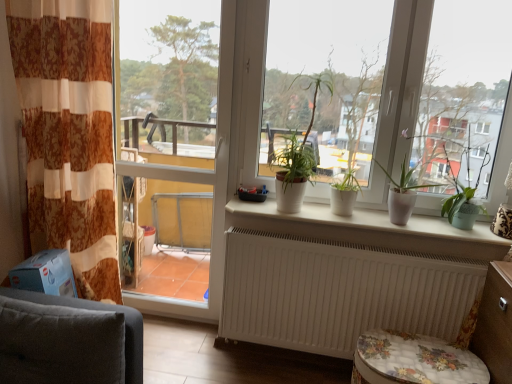
Question: Can you confirm if white matte pot at center, which is the 3th houseplant in left-to-right order, is taller than white matte radiator at lower center?

Choices:
 (A) yes
 (B) no

Answer: (B)

Question: Is white matte pot at center, the first houseplant from the right, oriented towards white matte radiator at lower center?

Choices:
 (A) no
 (B) yes

Answer: (A)

Question: From a real-world perspective, does white matte pot at center, the first houseplant from the right, sit lower than white matte radiator at lower center?

Choices:
 (A) no
 (B) yes

Answer: (A)

Question: Does white matte pot at center, which is the 3th houseplant in left-to-right order, appear on the right side of white matte radiator at lower center?

Choices:
 (A) yes
 (B) no

Answer: (A)

Question: Considering the relative sizes of white matte pot at center, which is the 3th houseplant in left-to-right order, and white matte radiator at lower center in the image provided, is white matte pot at center, which is the 3th houseplant in left-to-right order, thinner than white matte radiator at lower center?

Choices:
 (A) yes
 (B) no

Answer: (B)

Question: Considering the relative positions of white matte pot at center, the first houseplant from the right, and white matte radiator at lower center in the image provided, is white matte pot at center, the first houseplant from the right, behind white matte radiator at lower center?

Choices:
 (A) no
 (B) yes

Answer: (A)

Question: From a real-world perspective, is white matte pot at center, which is the 3th houseplant in left-to-right order, located higher than white ceramic plant pots at center?

Choices:
 (A) yes
 (B) no

Answer: (A)

Question: Does white matte pot at center, which is the 3th houseplant in left-to-right order, appear on the right side of white ceramic plant pots at center?

Choices:
 (A) yes
 (B) no

Answer: (A)

Question: Considering the relative sizes of white matte pot at center, which is the 3th houseplant in left-to-right order, and white ceramic plant pots at center in the image provided, is white matte pot at center, which is the 3th houseplant in left-to-right order, taller than white ceramic plant pots at center?

Choices:
 (A) no
 (B) yes

Answer: (B)

Question: Does white matte pot at center, which is the 3th houseplant in left-to-right order, have a larger size compared to white ceramic plant pots at center?

Choices:
 (A) no
 (B) yes

Answer: (B)

Question: Is white matte pot at center, the first houseplant from the right, positioned with its back to white ceramic plant pots at center?

Choices:
 (A) no
 (B) yes

Answer: (A)

Question: From the image's perspective, is white matte pot at center, which is the 3th houseplant in left-to-right order, below white ceramic plant pots at center?

Choices:
 (A) yes
 (B) no

Answer: (B)

Question: Considering the relative sizes of transparent glass screen door at left and white matte window at center in the image provided, is transparent glass screen door at left wider than white matte window at center?

Choices:
 (A) yes
 (B) no

Answer: (B)